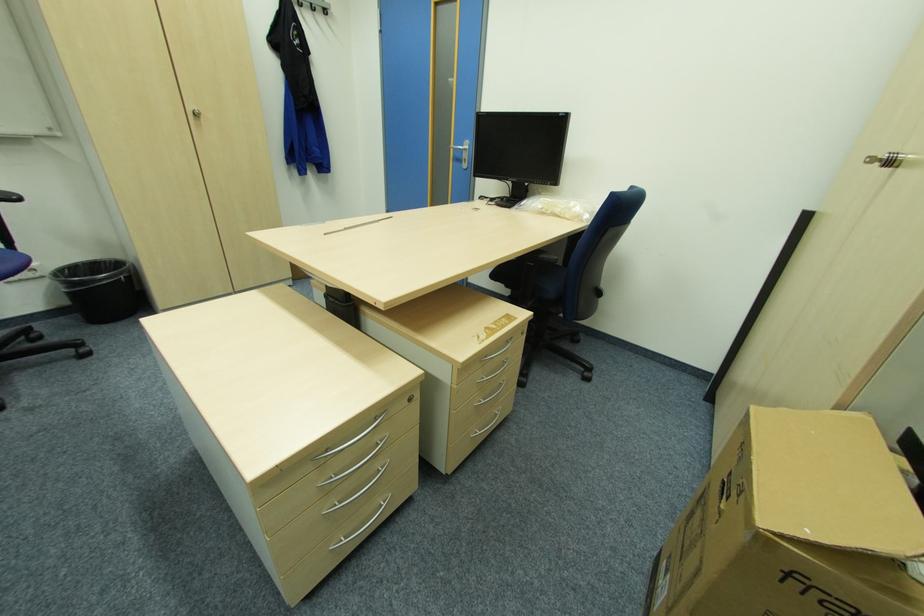
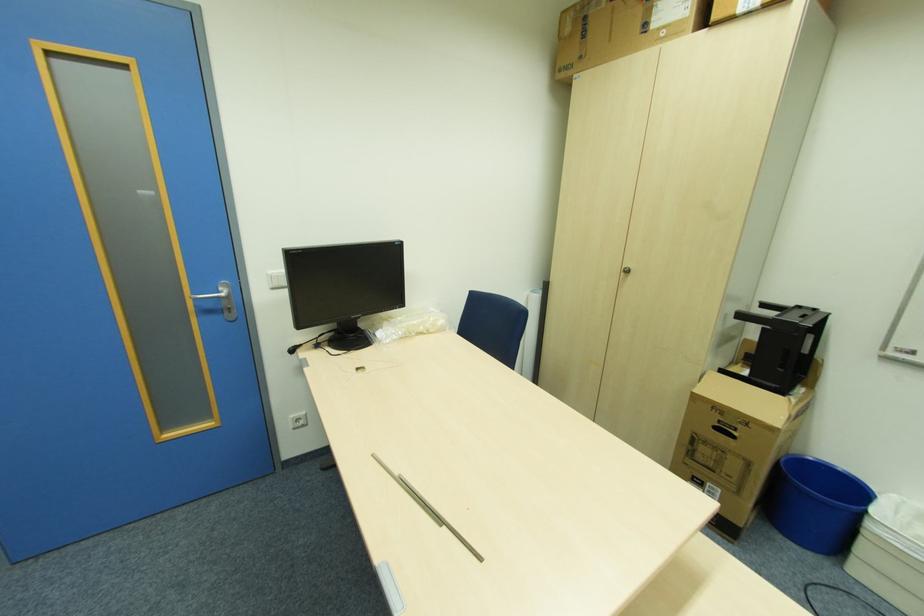
In the second image, find the point that corresponds to point 560,209 in the first image.

(424, 329)